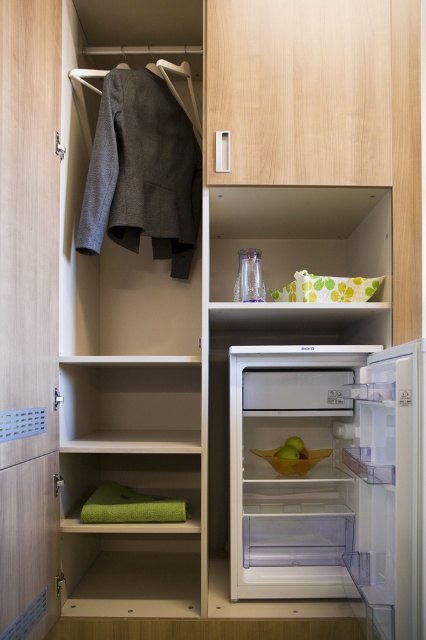
In the scene shown: You are moving a 40 cm wide box into the storage unit. You want to place it between the white plastic fridge at lower right and the green fabric towel at lower left. Is there enough space?

The white plastic fridge at lower right and green fabric towel at lower left are 37.90 centimeters apart, so there isn not enough space to place a 40 cm wide box between them since the gap is smaller than the box.

You are organizing items in the storage unit and need to place a tall plant pot that is 1 meter in height. Given the wooden door at left and the green fabric towel at lower left, which object would you avoid placing the plant pot next to and why?

You should avoid placing the plant pot next to the wooden door at left because it is much taller than the green fabric towel at lower left, making it a less stable support for a tall object.

You are organizing items in the storage unit and need to place a new item between the white plastic fridge at lower right and the green fabric towel at lower left. Based on their positions, where should you place the new item?

The white plastic fridge at lower right is located above the green fabric towel at lower left, so you should place the new item between them in the space below the fridge and above the towel.